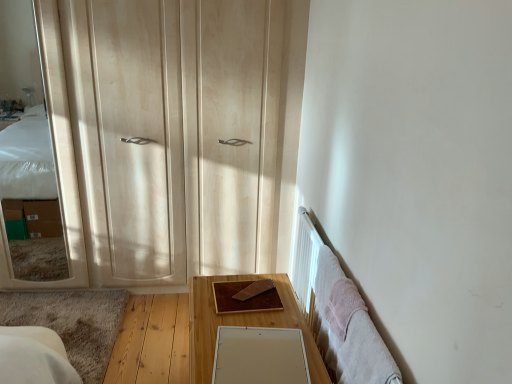
Question: Does white matte mirror at lower center, marked as the 2th mirror in a left-to-right arrangement, have a smaller size compared to light wood dresser at left?

Choices:
 (A) yes
 (B) no

Answer: (A)

Question: Is white matte mirror at lower center, the first mirror when ordered from front to back, further to camera compared to light wood dresser at left?

Choices:
 (A) yes
 (B) no

Answer: (B)

Question: Is white matte mirror at lower center, the first mirror from the right, at the left side of light wood dresser at left?

Choices:
 (A) no
 (B) yes

Answer: (A)

Question: From a real-world perspective, is white matte mirror at lower center, which appears as the second mirror when viewed from the top, below light wood dresser at left?

Choices:
 (A) no
 (B) yes

Answer: (B)

Question: Could you tell me if white matte mirror at lower center, marked as the 2th mirror in a left-to-right arrangement, is facing light wood dresser at left?

Choices:
 (A) no
 (B) yes

Answer: (A)

Question: From a real-world perspective, is white matte mirror at lower center, the first mirror from the right, on light wood dresser at left?

Choices:
 (A) yes
 (B) no

Answer: (B)

Question: Is brown wooden table at center to the left of matte wooden mirror at left, the second mirror ordered from the bottom, from the viewer's perspective?

Choices:
 (A) yes
 (B) no

Answer: (B)

Question: Is brown wooden table at center closer to camera compared to matte wooden mirror at left, the second mirror ordered from the bottom?

Choices:
 (A) yes
 (B) no

Answer: (A)

Question: Considering the relative sizes of brown wooden table at center and matte wooden mirror at left, the second mirror ordered from the bottom, in the image provided, is brown wooden table at center wider than matte wooden mirror at left, the second mirror ordered from the bottom,?

Choices:
 (A) no
 (B) yes

Answer: (B)

Question: Considering the relative sizes of brown wooden table at center and matte wooden mirror at left, the 2th mirror viewed from the right, in the image provided, is brown wooden table at center thinner than matte wooden mirror at left, the 2th mirror viewed from the right,?

Choices:
 (A) yes
 (B) no

Answer: (B)

Question: Could you tell me if brown wooden table at center is facing matte wooden mirror at left, the 2th mirror viewed from the right?

Choices:
 (A) yes
 (B) no

Answer: (B)

Question: From the image's perspective, would you say brown wooden table at center is shown under matte wooden mirror at left, the second mirror ordered from the bottom?

Choices:
 (A) no
 (B) yes

Answer: (B)

Question: Can you confirm if brown wooden table at center is thinner than light wood dresser at left?

Choices:
 (A) no
 (B) yes

Answer: (A)